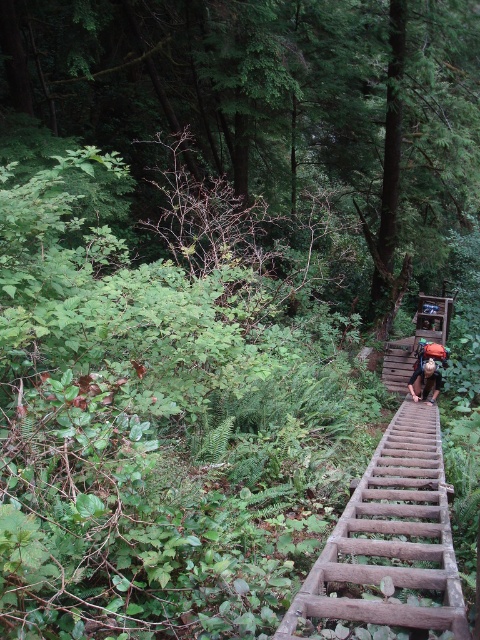
Question: Among these points, which one is nearest to the camera?

Choices:
 (A) pos(380,150)
 (B) pos(409,381)

Answer: (B)

Question: Where is green leafy tree at upper center located in relation to camouflage fabric backpack at center in the image?

Choices:
 (A) below
 (B) above

Answer: (B)

Question: Does green leafy tree at upper center come behind camouflage fabric backpack at center?

Choices:
 (A) no
 (B) yes

Answer: (A)

Question: Which point is closer to the camera taking this photo?

Choices:
 (A) (283, 120)
 (B) (432, 381)

Answer: (B)

Question: Is green leafy tree at upper center further to the viewer compared to camouflage fabric backpack at center?

Choices:
 (A) yes
 (B) no

Answer: (B)